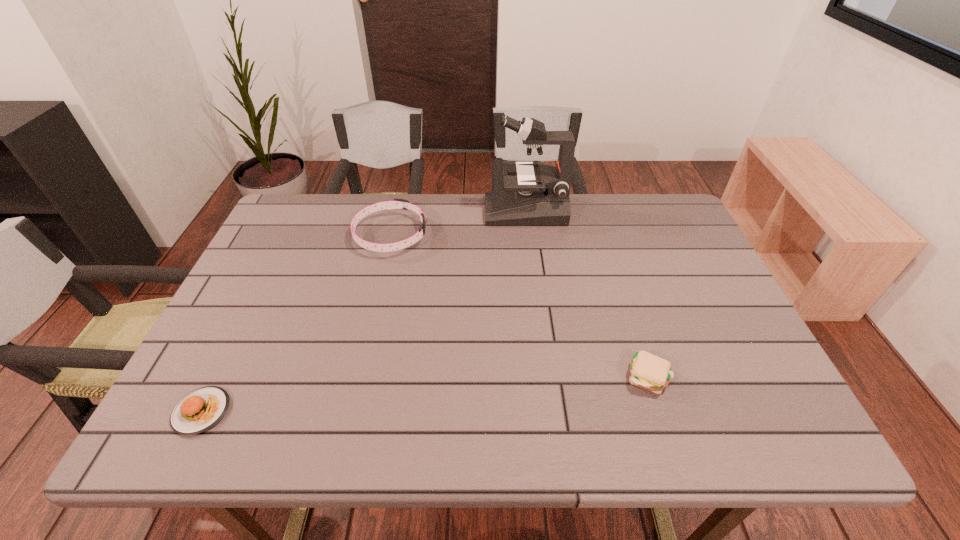
Image resolution: width=960 pixels, height=540 pixels. Identify the location of microscope. (534, 194).

The height and width of the screenshot is (540, 960). I want to click on the second object from right to left, so click(534, 194).

Find the location of `the second object from left to right`. the second object from left to right is located at coordinates (396, 203).

You are a GUI agent. You are given a task and a screenshot of the screen. Output one action in this format:
    pyautogui.click(x=<x>, y=<y>)
    Task: Click on the dog collar
    
    Given the screenshot: What is the action you would take?
    pyautogui.click(x=396, y=203)

Find the location of a particular element. This screenshot has width=960, height=540. the taller food is located at coordinates [x=647, y=371].

I want to click on the third tallest object, so click(x=647, y=371).

Identify the location of the leftmost object. (201, 409).

The width and height of the screenshot is (960, 540). I want to click on the left food, so click(201, 409).

Identify the location of free space located 0.140m through the eyepieces of the microscope. The image size is (960, 540). (442, 211).

Find the location of `free space located 0.140m through the eyepieces of the microscope`. free space located 0.140m through the eyepieces of the microscope is located at coordinates (442, 211).